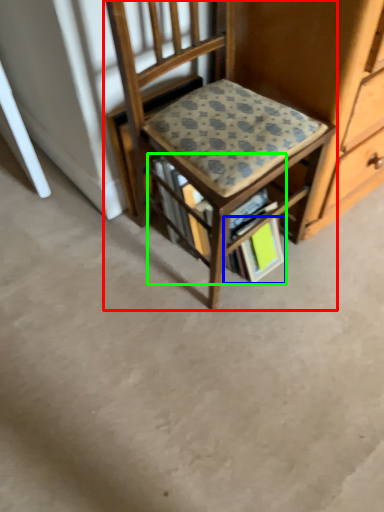
Question: Which object is positioned farthest from chair (highlighted by a red box)? Select from paperback book (highlighted by a blue box) and book (highlighted by a green box).

Choices:
 (A) paperback book
 (B) book

Answer: (A)